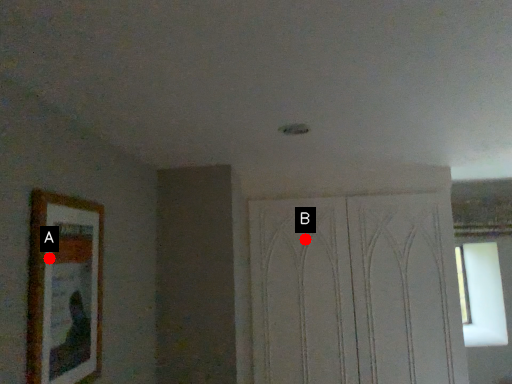
Question: Two points are circled on the image, labeled by A and B beside each circle. Which of the following is the closest to the observer?

Choices:
 (A) A is closer
 (B) B is closer

Answer: (A)